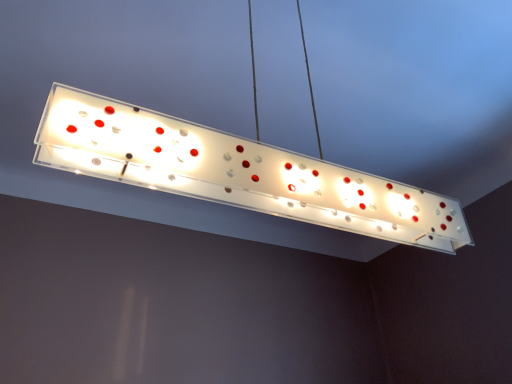
I want to click on transparent plastic lamp at center, so click(238, 169).

The width and height of the screenshot is (512, 384). What do you see at coordinates (238, 169) in the screenshot? I see `transparent plastic lamp at center` at bounding box center [238, 169].

The width and height of the screenshot is (512, 384). In order to click on transparent plastic lamp at center in this screenshot , I will do [x=238, y=169].